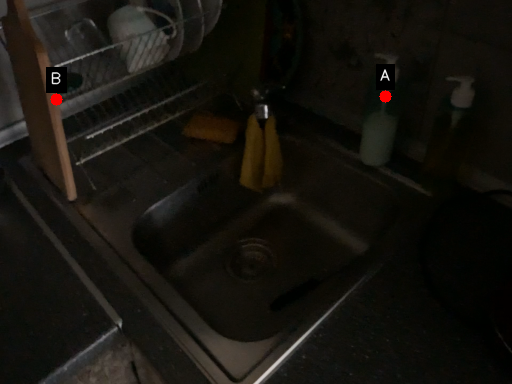
Question: Two points are circled on the image, labeled by A and B beside each circle. Which point is further to the camera?

Choices:
 (A) A is further
 (B) B is further

Answer: (A)